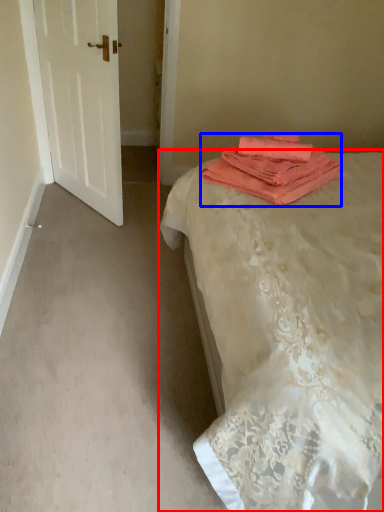
Question: Which object is further to the camera taking this photo, bed (highlighted by a red box) or towel (highlighted by a blue box)?

Choices:
 (A) bed
 (B) towel

Answer: (B)